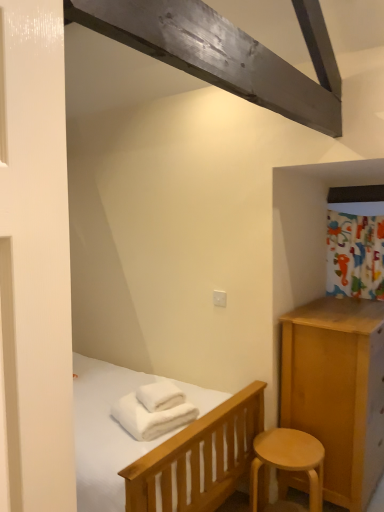
What do you see at coordinates (152, 416) in the screenshot? Image resolution: width=384 pixels, height=512 pixels. I see `white soft bath towel at lower center, acting as the first bath towel starting from the bottom` at bounding box center [152, 416].

You are a GUI agent. You are given a task and a screenshot of the screen. Output one action in this format:
    pyautogui.click(x=<x>, y=<y>)
    Task: Click on the light wood stool at lower right
    
    Given the screenshot: What is the action you would take?
    pyautogui.click(x=289, y=460)

Measure the distance between point (322, 464) and camera.

Point (322, 464) is 2.24 meters from camera.

Identify the location of white soft towel at center, arranged as the first bath towel when viewed from the top. This screenshot has height=512, width=384. (160, 396).

In order to click on white soft bath towel at lower center, the 2th bath towel when ordered from top to bottom in this screenshot , I will do click(x=152, y=416).

From a real-world perspective, is white soft towel at center, arranged as the first bath towel when viewed from the top, physically above white soft bath towel at lower center, the 2th bath towel when ordered from top to bottom?

Indeed, from a real-world perspective, white soft towel at center, arranged as the first bath towel when viewed from the top, stands above white soft bath towel at lower center, the 2th bath towel when ordered from top to bottom.

Does white soft towel at center, arranged as the first bath towel when viewed from the top, have a larger size compared to white soft bath towel at lower center, acting as the first bath towel starting from the bottom?

No, white soft towel at center, arranged as the first bath towel when viewed from the top, is not bigger than white soft bath towel at lower center, acting as the first bath towel starting from the bottom.

Between white soft towel at center, which appears as the second bath towel when ordered from the bottom, and white soft bath towel at lower center, acting as the first bath towel starting from the bottom, which one has smaller width?

With smaller width is white soft towel at center, which appears as the second bath towel when ordered from the bottom.

Does white soft towel at center, which appears as the second bath towel when ordered from the bottom, have a greater height compared to white soft bath towel at lower center, acting as the first bath towel starting from the bottom?

Incorrect, the height of white soft towel at center, which appears as the second bath towel when ordered from the bottom, is not larger of that of white soft bath towel at lower center, acting as the first bath towel starting from the bottom.

Considering their positions, is white soft bath towel at lower center, acting as the first bath towel starting from the bottom, located in front of or behind light wood stool at lower right?

Visually, white soft bath towel at lower center, acting as the first bath towel starting from the bottom, is located in front of light wood stool at lower right.

Which is more to the right, white soft bath towel at lower center, the 2th bath towel when ordered from top to bottom, or light wood stool at lower right?

light wood stool at lower right is more to the right.

From the image's perspective, is white soft bath towel at lower center, acting as the first bath towel starting from the bottom, on light wood stool at lower right?

Yes, from the image's perspective, white soft bath towel at lower center, acting as the first bath towel starting from the bottom, is above light wood stool at lower right.

Looking at this image, is light wood stool at lower right at the back of white soft bath towel at lower center, acting as the first bath towel starting from the bottom?

No, white soft bath towel at lower center, acting as the first bath towel starting from the bottom, is not facing the opposite direction of light wood stool at lower right.

How many degrees apart are the facing directions of light wood stool at lower right and white soft bath towel at lower center, acting as the first bath towel starting from the bottom?

The facing directions of light wood stool at lower right and white soft bath towel at lower center, acting as the first bath towel starting from the bottom, are 57.4 degrees apart.

Does light wood stool at lower right have a lesser height compared to white soft bath towel at lower center, the 2th bath towel when ordered from top to bottom?

In fact, light wood stool at lower right may be taller than white soft bath towel at lower center, the 2th bath towel when ordered from top to bottom.

Is light wood stool at lower right not within white soft bath towel at lower center, acting as the first bath towel starting from the bottom?

Yes, light wood stool at lower right is outside of white soft bath towel at lower center, acting as the first bath towel starting from the bottom.

Is white soft towel at center, arranged as the first bath towel when viewed from the top, aimed at light wood stool at lower right?

No, white soft towel at center, arranged as the first bath towel when viewed from the top, is not aimed at light wood stool at lower right.

Which is closer to the camera, (171,382) or (296,449)?

Point (171,382) appears to be farther away from the viewer than point (296,449).

Considering the sizes of objects white soft towel at center, which appears as the second bath towel when ordered from the bottom, and light wood stool at lower right in the image provided, who is shorter, white soft towel at center, which appears as the second bath towel when ordered from the bottom, or light wood stool at lower right?

Standing shorter between the two is white soft towel at center, which appears as the second bath towel when ordered from the bottom.

Considering the sizes of objects white soft bath towel at lower center, the 2th bath towel when ordered from top to bottom, and white soft towel at center, arranged as the first bath towel when viewed from the top, in the image provided, who is taller, white soft bath towel at lower center, the 2th bath towel when ordered from top to bottom, or white soft towel at center, arranged as the first bath towel when viewed from the top,?

With more height is white soft bath towel at lower center, the 2th bath towel when ordered from top to bottom.

Can you confirm if white soft bath towel at lower center, acting as the first bath towel starting from the bottom, is bigger than white soft towel at center, which appears as the second bath towel when ordered from the bottom?

Yes.

Does point (122, 409) come behind point (167, 382)?

No.

Would you say light wood stool at lower right is a long distance from white soft towel at center, which appears as the second bath towel when ordered from the bottom?

light wood stool at lower right is actually quite close to white soft towel at center, which appears as the second bath towel when ordered from the bottom.

From the image's perspective, is light wood stool at lower right positioned above or below white soft towel at center, arranged as the first bath towel when viewed from the top?

Based on their image positions, light wood stool at lower right is located beneath white soft towel at center, arranged as the first bath towel when viewed from the top.

Is the depth of light wood stool at lower right less than that of white soft towel at center, which appears as the second bath towel when ordered from the bottom?

Yes, it is.

Considering the sizes of objects light wood stool at lower right and white soft towel at center, arranged as the first bath towel when viewed from the top, in the image provided, who is bigger, light wood stool at lower right or white soft towel at center, arranged as the first bath towel when viewed from the top,?

With larger size is light wood stool at lower right.

Locate an element on the screen. bath towel above the white soft bath towel at lower center, acting as the first bath towel starting from the bottom (from the image's perspective) is located at coordinates (160, 396).

Image resolution: width=384 pixels, height=512 pixels. Identify the location of stool lying behind the white soft bath towel at lower center, the 2th bath towel when ordered from top to bottom. (289, 460).

From the image, which object appears to be farther from light wood stool at lower right, white soft bath towel at lower center, acting as the first bath towel starting from the bottom, or white soft towel at center, arranged as the first bath towel when viewed from the top?

white soft towel at center, arranged as the first bath towel when viewed from the top.

Based on their spatial positions, is white soft towel at center, arranged as the first bath towel when viewed from the top, or light wood stool at lower right further from white soft bath towel at lower center, the 2th bath towel when ordered from top to bottom?

light wood stool at lower right is further to white soft bath towel at lower center, the 2th bath towel when ordered from top to bottom.

Looking at the image, which one is located closer to white soft towel at center, which appears as the second bath towel when ordered from the bottom, light wood stool at lower right or white soft bath towel at lower center, the 2th bath towel when ordered from top to bottom?

Among the two, white soft bath towel at lower center, the 2th bath towel when ordered from top to bottom, is located nearer to white soft towel at center, which appears as the second bath towel when ordered from the bottom.

Considering their positions, is white soft bath towel at lower center, acting as the first bath towel starting from the bottom, positioned closer to white soft towel at center, which appears as the second bath towel when ordered from the bottom, than light wood stool at lower right?

white soft bath towel at lower center, acting as the first bath towel starting from the bottom, is positioned closer to the anchor white soft towel at center, which appears as the second bath towel when ordered from the bottom.

Which object lies further to the anchor point white soft bath towel at lower center, the 2th bath towel when ordered from top to bottom, light wood stool at lower right or white soft towel at center, arranged as the first bath towel when viewed from the top?

light wood stool at lower right is positioned further to the anchor white soft bath towel at lower center, the 2th bath towel when ordered from top to bottom.

Based on their spatial positions, is white soft towel at center, arranged as the first bath towel when viewed from the top, or white soft bath towel at lower center, the 2th bath towel when ordered from top to bottom, closer to light wood stool at lower right?

white soft bath towel at lower center, the 2th bath towel when ordered from top to bottom, is positioned closer to the anchor light wood stool at lower right.

You are a GUI agent. You are given a task and a screenshot of the screen. Output one action in this format:
    pyautogui.click(x=<x>, y=<y>)
    Task: Click on the bath towel situated between white soft bath towel at lower center, acting as the first bath towel starting from the bottom, and light wood stool at lower right from left to right
    The image size is (384, 512).
    Given the screenshot: What is the action you would take?
    pyautogui.click(x=160, y=396)